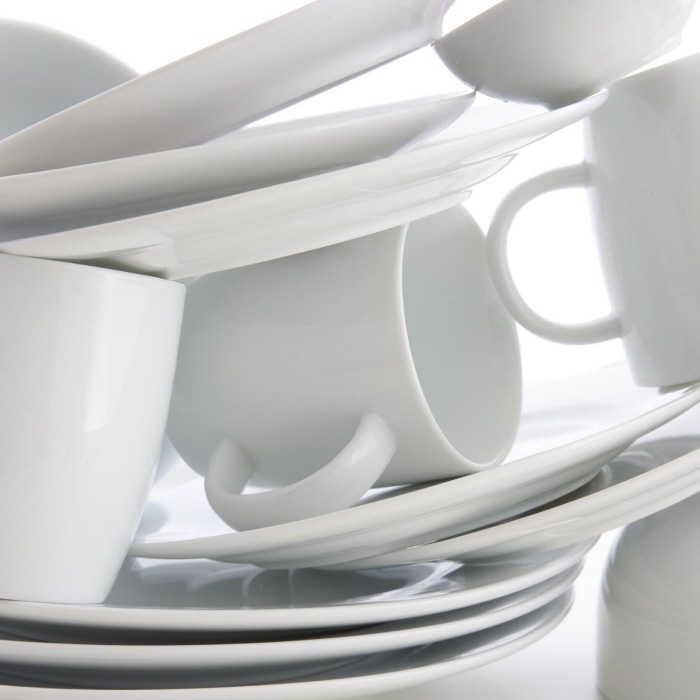
Where is `mugs and bowls`? The height and width of the screenshot is (700, 700). mugs and bowls is located at coordinates (80, 393), (309, 365), (645, 238), (584, 34), (98, 68).